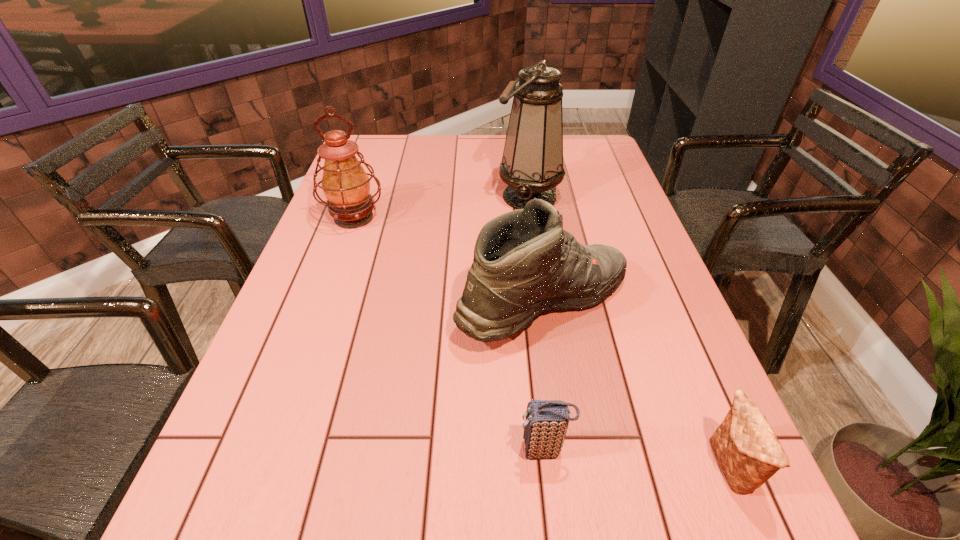
Image resolution: width=960 pixels, height=540 pixels. Find the location of `vacant space at the far edge`. vacant space at the far edge is located at coordinates (394, 165).

You are a GUI agent. You are given a task and a screenshot of the screen. Output one action in this format:
    pyautogui.click(x=<x>, y=<y>)
    Task: Click on the vacant space at the left edge
    Image resolution: width=960 pixels, height=540 pixels.
    Given the screenshot: What is the action you would take?
    pyautogui.click(x=307, y=366)

In the image, there is a desktop. Find the location of `vacant space at the right edge`. vacant space at the right edge is located at coordinates (699, 481).

The image size is (960, 540). I want to click on free space at the far left corner of the desktop, so coord(376,150).

At what (x,y) coordinates should I click in order to perform the action: click on unoccupied position between the shorter oil lamp and the ski boot. Please return your answer as a coordinate pair (x, y). Looking at the image, I should click on (449, 261).

Find the location of `empty space that is in between the ski boot and the leftmost object`. empty space that is in between the ski boot and the leftmost object is located at coordinates (449, 261).

This screenshot has width=960, height=540. I want to click on free point between the left oil lamp and the third nearest object, so click(449, 261).

Locate an element on the screen. The image size is (960, 540). vacant area that lies between the left clutch bag and the right oil lamp is located at coordinates (536, 323).

Where is `vacant space in between the rightmost object and the leftmost object`? vacant space in between the rightmost object and the leftmost object is located at coordinates 541,342.

I want to click on vacant area that lies between the right oil lamp and the left oil lamp, so click(441, 207).